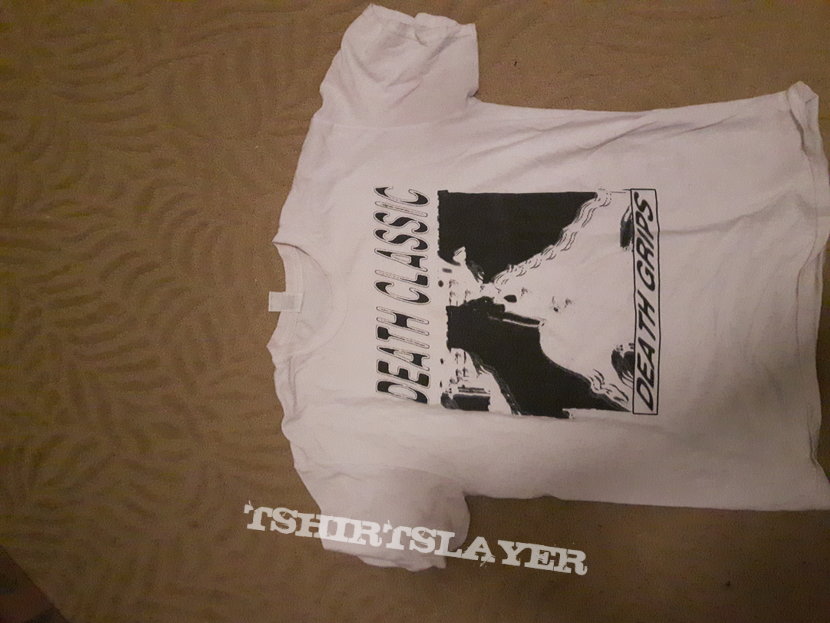
You are a GUI agent. You are given a task and a screenshot of the screen. Output one action in this format:
    pyautogui.click(x=<x>, y=<y>)
    Task: Click on the dark brown flooring
    The height and width of the screenshot is (623, 830).
    Given the screenshot: What is the action you would take?
    pyautogui.click(x=7, y=607)